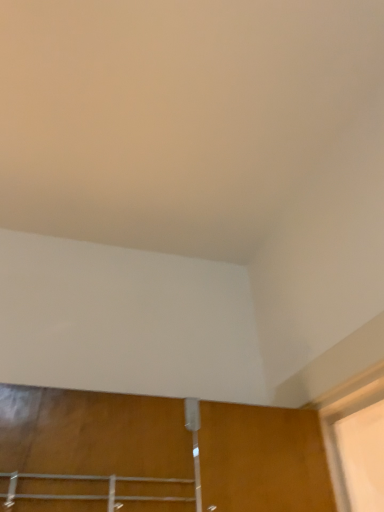
The height and width of the screenshot is (512, 384). In order to click on matte brown dresser at lower left in this screenshot , I will do `click(97, 437)`.

The image size is (384, 512). Describe the element at coordinates (97, 437) in the screenshot. I see `matte brown dresser at lower left` at that location.

Where is `matte brown dresser at lower left`? This screenshot has width=384, height=512. matte brown dresser at lower left is located at coordinates (97, 437).